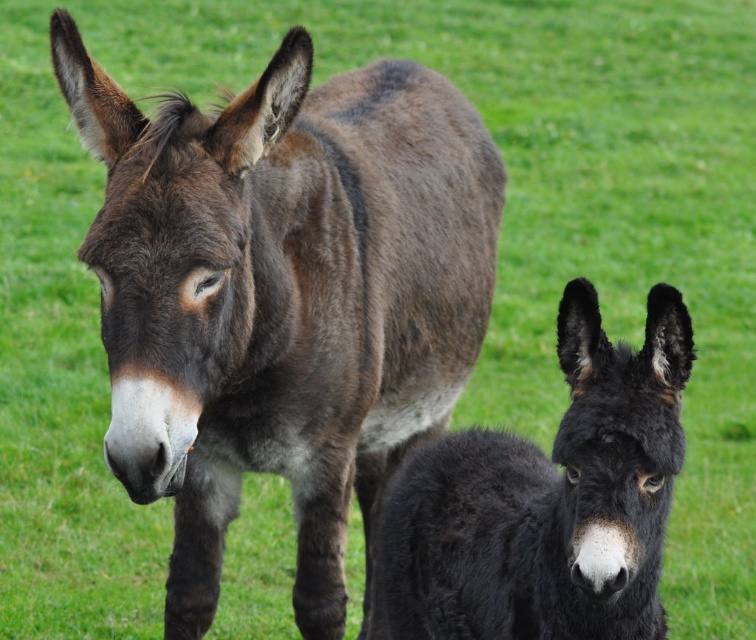
Between dark brown fur mule at center and black fuzzy donkey at lower right, which one has more height?

With more height is dark brown fur mule at center.

Is dark brown fur mule at center thinner than black fuzzy donkey at lower right?

No.

Measure the distance between dark brown fur mule at center and camera.

A distance of 8.58 feet exists between dark brown fur mule at center and camera.

Find the location of a particular element. Image resolution: width=756 pixels, height=640 pixels. dark brown fur mule at center is located at coordinates (282, 296).